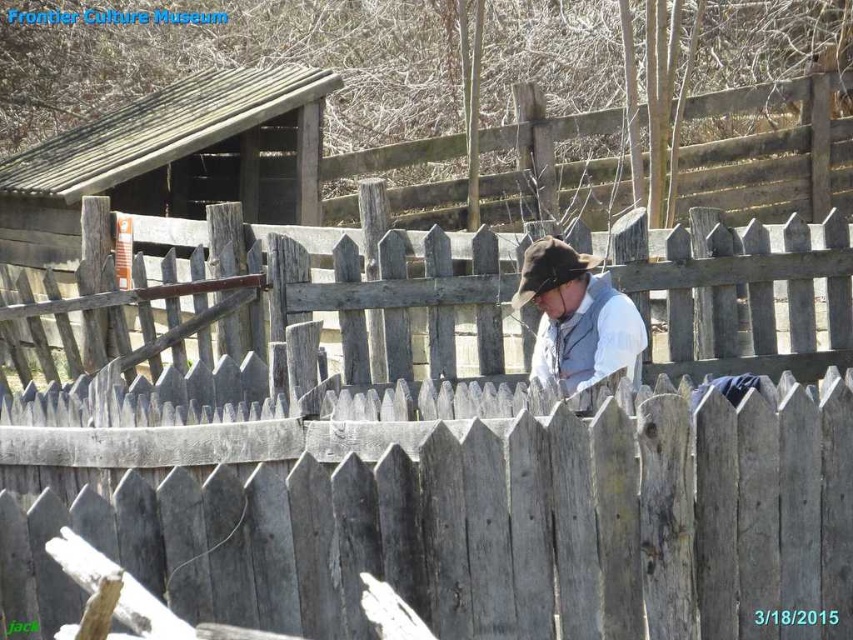
You are a visitor at the Frontier Culture Museum and notice two items at the center of the scene. Which item is closer to you, the white cotton shirt at center or the brown felt cowboy hat at center?

The white cotton shirt at center is closer to you because it is in front of the brown felt cowboy hat at center.

You are standing in front of the wooden picket fence at the Frontier Culture Museum. You notice two points marked on the fence. The first point is at coordinates point (x=607, y=326), and the second is at point (x=540, y=250). Which point is closer to your face?

Point (x=540, y=250) is closer to your face because it is closer to the camera than point (x=607, y=326).

You are a photographer trying to capture a clear photo of the white cotton shirt at center and the brown felt cowboy hat at center. Your camera can only focus on objects within a 5 inch range. Will both items be in focus?

The white cotton shirt at center and the brown felt cowboy hat at center are 5.37 inches apart. Since the distance between them exceeds the 5 inch focus range, they cannot both be in focus at the same time.